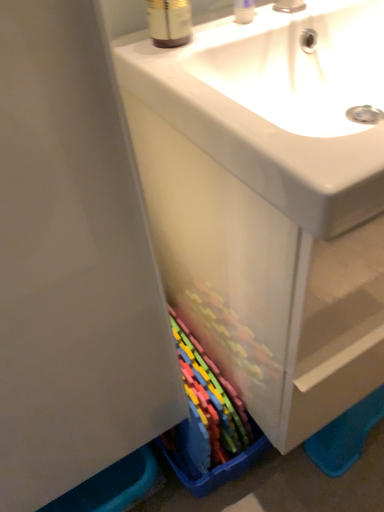
Question: Should I look upward or downward to see brown plastic bottle at upper center?

Choices:
 (A) down
 (B) up

Answer: (B)

Question: Is matte plastic cabinet at center with brown plastic bottle at upper center?

Choices:
 (A) yes
 (B) no

Answer: (B)

Question: From the image's perspective, is matte plastic cabinet at center beneath brown plastic bottle at upper center?

Choices:
 (A) no
 (B) yes

Answer: (B)

Question: Does matte plastic cabinet at center appear on the right side of brown plastic bottle at upper center?

Choices:
 (A) no
 (B) yes

Answer: (B)

Question: Would you say matte plastic cabinet at center is a long distance from brown plastic bottle at upper center?

Choices:
 (A) no
 (B) yes

Answer: (A)

Question: Does matte plastic cabinet at center have a smaller size compared to brown plastic bottle at upper center?

Choices:
 (A) no
 (B) yes

Answer: (A)

Question: Is matte plastic cabinet at center positioned in front of brown plastic bottle at upper center?

Choices:
 (A) yes
 (B) no

Answer: (A)

Question: From a real-world perspective, is clear plastic container at upper center located beneath brown plastic bottle at upper center?

Choices:
 (A) no
 (B) yes

Answer: (B)

Question: Is clear plastic container at upper center to the right of brown plastic bottle at upper center from the viewer's perspective?

Choices:
 (A) yes
 (B) no

Answer: (A)

Question: Is clear plastic container at upper center further to camera compared to brown plastic bottle at upper center?

Choices:
 (A) yes
 (B) no

Answer: (A)

Question: Is clear plastic container at upper center shorter than brown plastic bottle at upper center?

Choices:
 (A) no
 (B) yes

Answer: (B)

Question: Does clear plastic container at upper center appear on the left side of brown plastic bottle at upper center?

Choices:
 (A) yes
 (B) no

Answer: (B)

Question: Considering the relative sizes of clear plastic container at upper center and brown plastic bottle at upper center in the image provided, is clear plastic container at upper center bigger than brown plastic bottle at upper center?

Choices:
 (A) no
 (B) yes

Answer: (A)

Question: Considering the relative sizes of clear plastic container at upper center and matte plastic cabinet at center in the image provided, is clear plastic container at upper center wider than matte plastic cabinet at center?

Choices:
 (A) yes
 (B) no

Answer: (B)